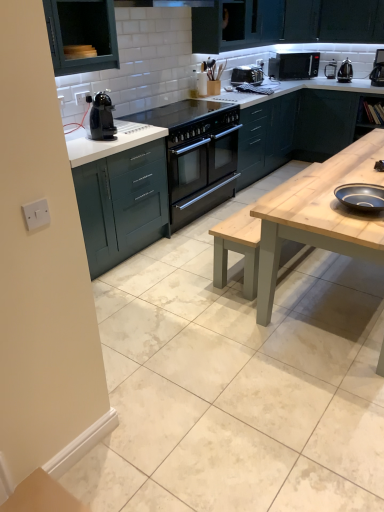
The width and height of the screenshot is (384, 512). I want to click on vacant space situated on the left part of matte blue bowl at center, the second appliance viewed from the left, so click(317, 203).